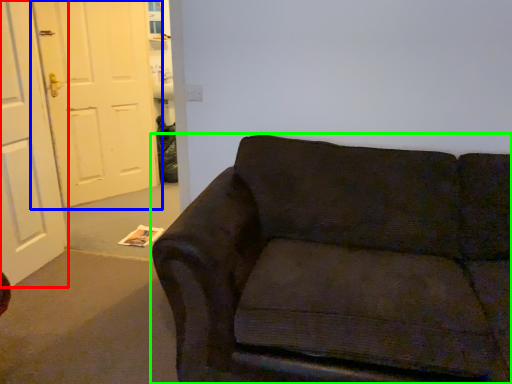
Question: Estimate the real-world distances between objects in this image. Which object is farther from door (highlighted by a red box), door (highlighted by a blue box) or studio couch (highlighted by a green box)?

Choices:
 (A) door
 (B) studio couch

Answer: (B)